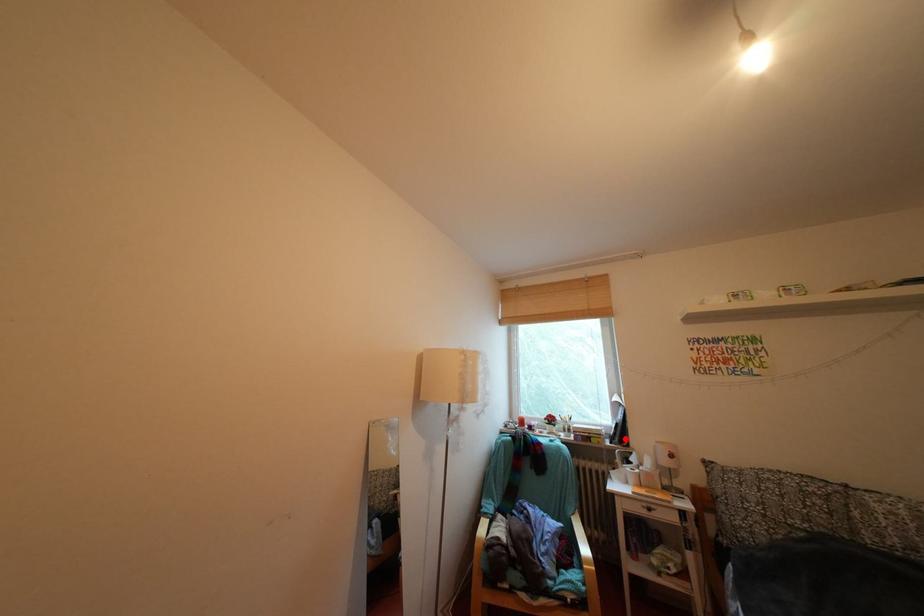
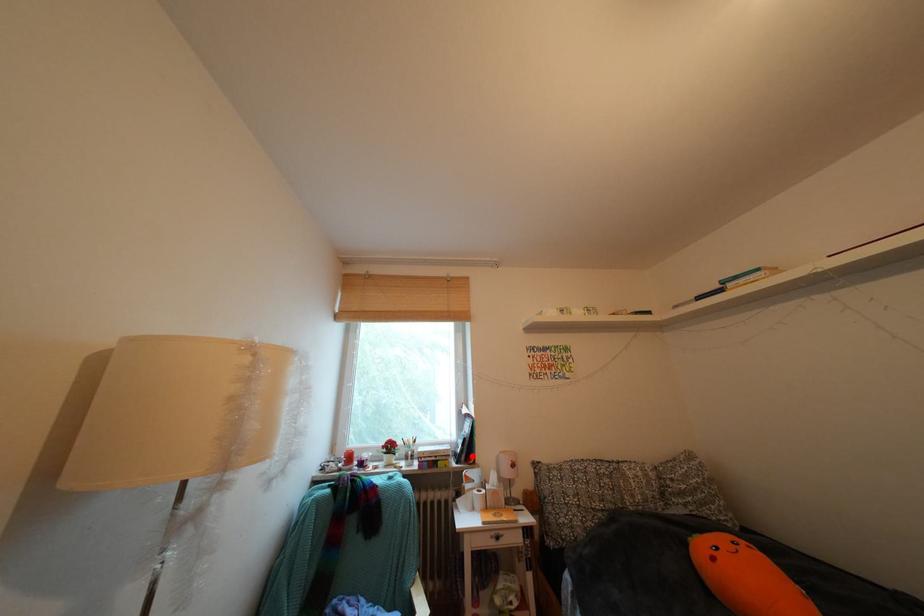
I am providing you with two images of the same scene from different viewpoints. A red point is marked on the first image and another point is marked on the second image. Is the red point in image1 aligned with the point shown in image2?

Yes